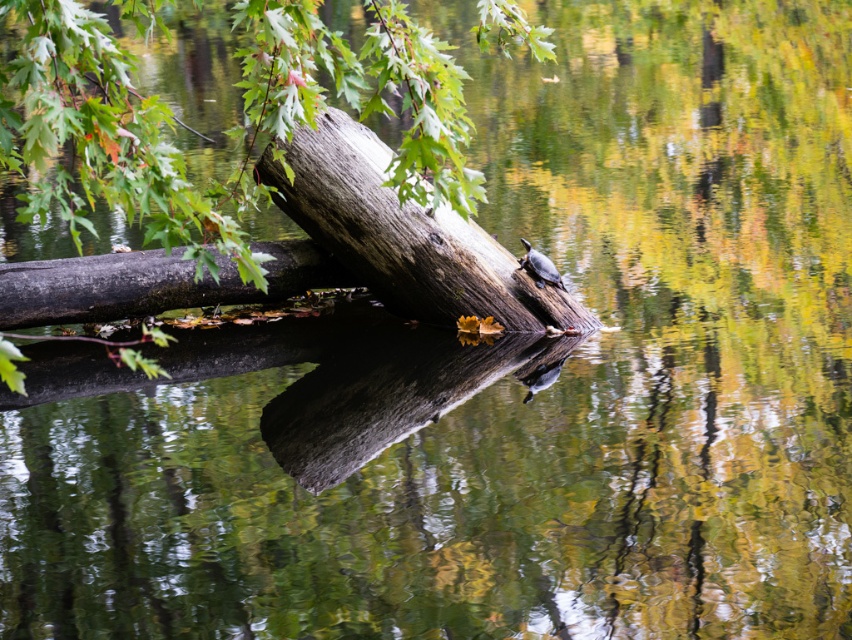
Question: Which of these objects is positioned farthest from the brown rough tree trunk at center?

Choices:
 (A) smooth brown log at center
 (B) gray rough log at center

Answer: (A)

Question: Can you confirm if gray rough log at center is positioned below brown rough tree trunk at center?

Choices:
 (A) yes
 (B) no

Answer: (B)

Question: Can you confirm if smooth brown log at center is thinner than brown rough tree trunk at center?

Choices:
 (A) no
 (B) yes

Answer: (A)

Question: Which of these objects is positioned farthest from the gray rough log at center?

Choices:
 (A) brown rough tree trunk at center
 (B) smooth brown log at center

Answer: (B)

Question: Where is smooth brown log at center located in relation to brown rough tree trunk at center in the image?

Choices:
 (A) right
 (B) left

Answer: (A)

Question: Which is farther from the gray rough log at center?

Choices:
 (A) brown rough tree trunk at center
 (B) smooth brown log at center

Answer: (B)